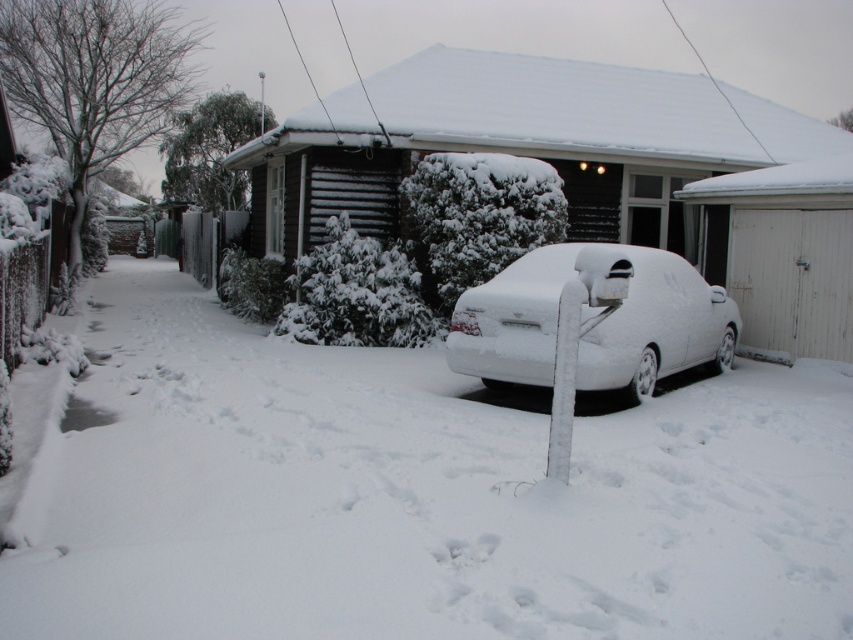
Can you confirm if white fluffy snow at center is positioned above white frosted post at center?

Incorrect, white fluffy snow at center is not positioned above white frosted post at center.

Who is more forward, (x=675, y=577) or (x=560, y=336)?

Positioned in front is point (x=675, y=577).

Find the location of a particular element. This screenshot has width=853, height=640. white fluffy snow at center is located at coordinates (418, 493).

Between white matte car at center and white frosted post at center, which one appears on the right side from the viewer's perspective?

Positioned to the right is white matte car at center.

Is white matte car at center wider than white frosted post at center?

Indeed, white matte car at center has a greater width compared to white frosted post at center.

Describe the element at coordinates (593, 323) in the screenshot. This screenshot has height=640, width=853. I see `white matte car at center` at that location.

Image resolution: width=853 pixels, height=640 pixels. Find the location of `white matte car at center`. white matte car at center is located at coordinates (593, 323).

Who is more forward, (148, 616) or (546, 259)?

Point (148, 616)

This screenshot has width=853, height=640. In order to click on white fluffy snow at center in this screenshot , I will do `click(418, 493)`.

At what (x,y) coordinates should I click in order to perform the action: click on white fluffy snow at center. Please return your answer as a coordinate pair (x, y). Image resolution: width=853 pixels, height=640 pixels. Looking at the image, I should click on (418, 493).

Where is `white fluffy snow at center`? The width and height of the screenshot is (853, 640). white fluffy snow at center is located at coordinates (418, 493).